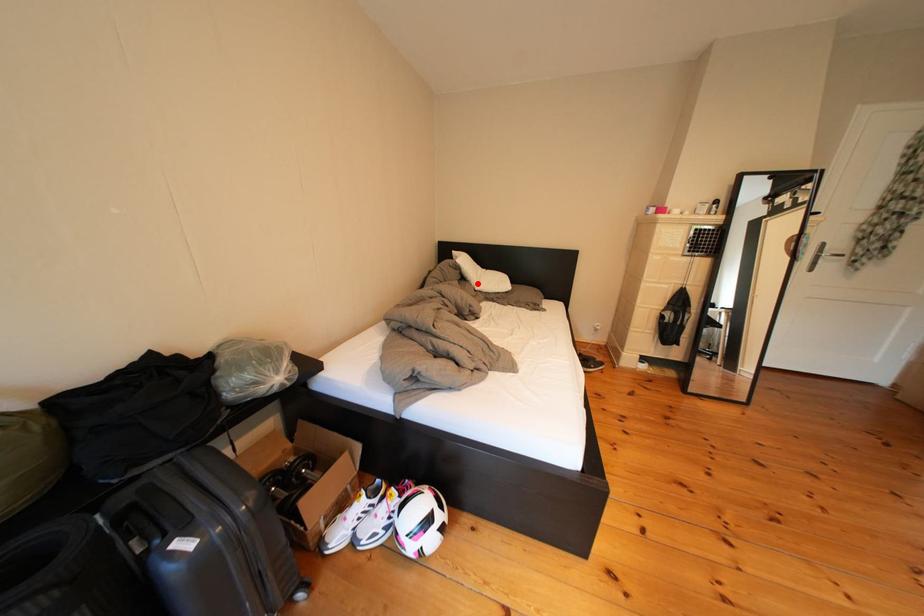
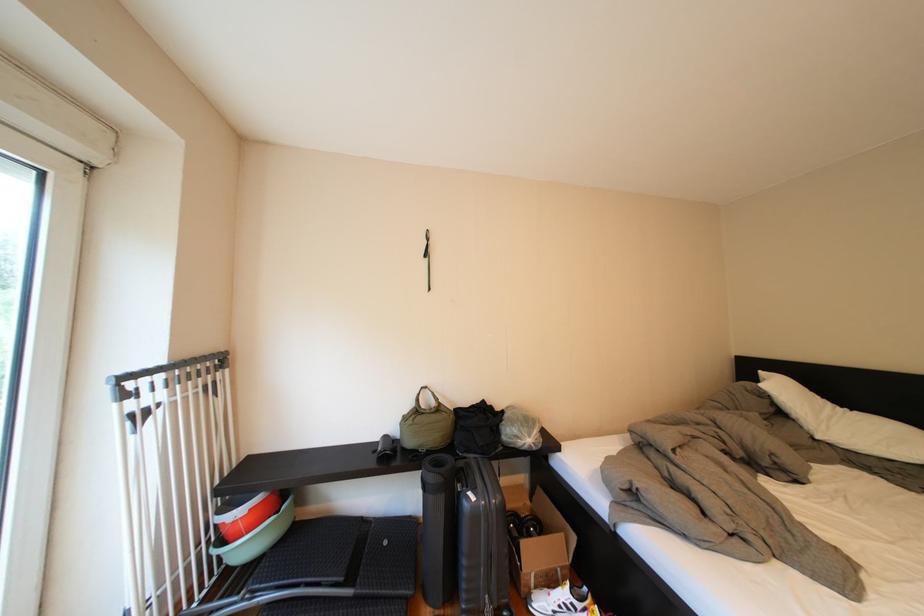
Question: I am providing you with two images of the same scene from different viewpoints. A red point is marked on the first image. Can you still see the location of the red point in image 2?

Choices:
 (A) Yes
 (B) No

Answer: (A)